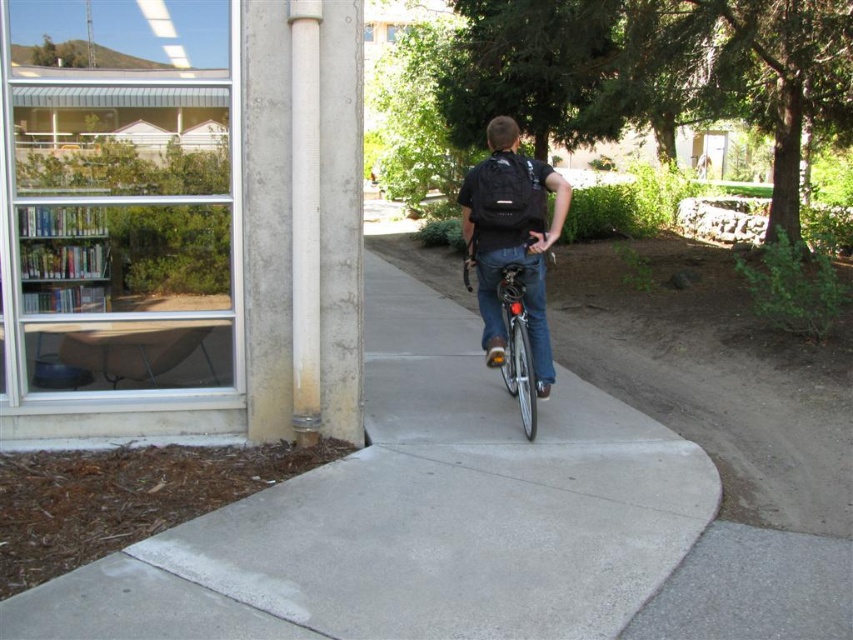
You are a maintenance worker needing to replace the white smooth pipe at center. The shiny metallic bicycle at center is blocking access to the pipe. Can you remove the bicycle to work on the pipe?

The white smooth pipe at center is narrower than the shiny metallic bicycle at center, so you can remove the bicycle to work on the pipe since the pipe is thinner and the bicycle is wider.

You are a delivery person carrying a box that is 1.2 meters wide. You need to navigate through the space between the black matte backpack at center and the white smooth pipe at center. Can your box fit through this space?

The distance between the black matte backpack at center and the white smooth pipe at center is 1.40 meters. Since your box is 1.2 meters wide, it can fit through the space as there is enough clearance.

You are a delivery person who needs to deliver a package to the building. You are currently standing at the black matte backpack at center. Which direction should you walk to reach the white smooth pipe at center?

The white smooth pipe at center is behind the black matte backpack at center, so you should walk backward to reach it.